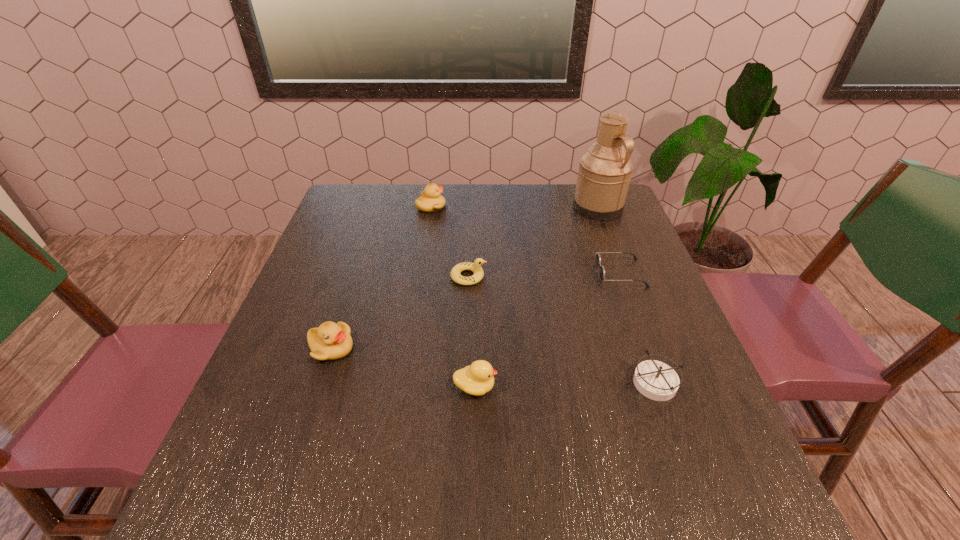
Locate an element on the screen. object located at the left edge is located at coordinates (330, 341).

Image resolution: width=960 pixels, height=540 pixels. Find the location of `pitcher at the right edge`. pitcher at the right edge is located at coordinates (604, 173).

The width and height of the screenshot is (960, 540). Find the location of `compass located in the right edge section of the desktop`. compass located in the right edge section of the desktop is located at coordinates point(655,380).

This screenshot has height=540, width=960. I want to click on sunglasses that is at the right edge, so click(x=598, y=258).

This screenshot has width=960, height=540. In order to click on object that is at the far right corner in this screenshot , I will do `click(604, 173)`.

Where is `vacant space at the far edge`? The height and width of the screenshot is (540, 960). vacant space at the far edge is located at coordinates (466, 184).

This screenshot has width=960, height=540. I want to click on vacant space at the left edge, so click(x=318, y=392).

I want to click on free space at the right edge, so click(653, 305).

The image size is (960, 540). Find the location of `free space between the third duckling from right to left and the leftmost duckling`. free space between the third duckling from right to left and the leftmost duckling is located at coordinates (381, 277).

In order to click on free space between the nearest duckling and the compass in this screenshot , I will do `click(564, 384)`.